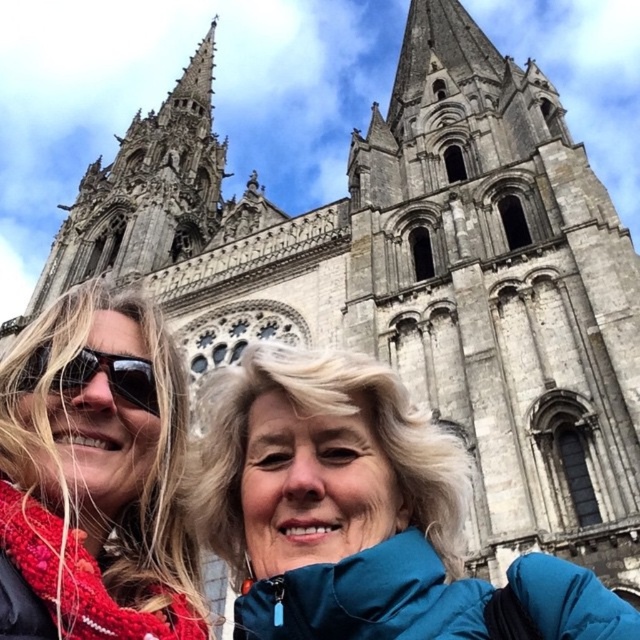
You are a photographer standing in front of a Gothic cathedral with a central spire. You see a blue fabric jacket at center and a black plastic goggles at left. Which object is taller?

The blue fabric jacket at center is taller than the black plastic goggles at left.

You are standing in front of the cathedral and want to take a photo of the two points marked in the image. Which point, point (452,545) or point (88,332), is closer to you?

Point (452,545) is closer to you than point (88,332) because it is further to the viewer.